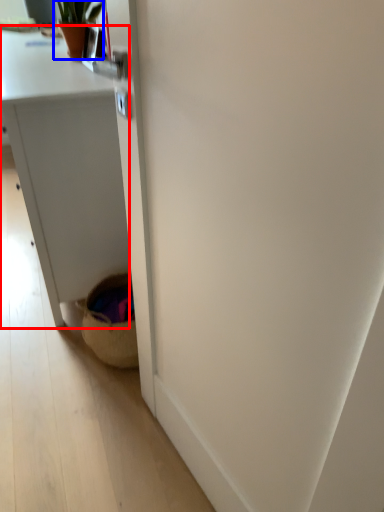
Question: Which of the following is the farthest to the observer, desk (highlighted by a red box) or houseplant (highlighted by a blue box)?

Choices:
 (A) desk
 (B) houseplant

Answer: (B)